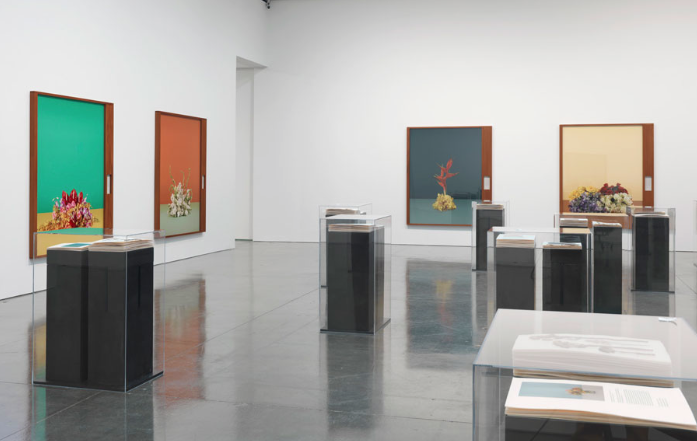
I want to click on book, so click(x=602, y=400).